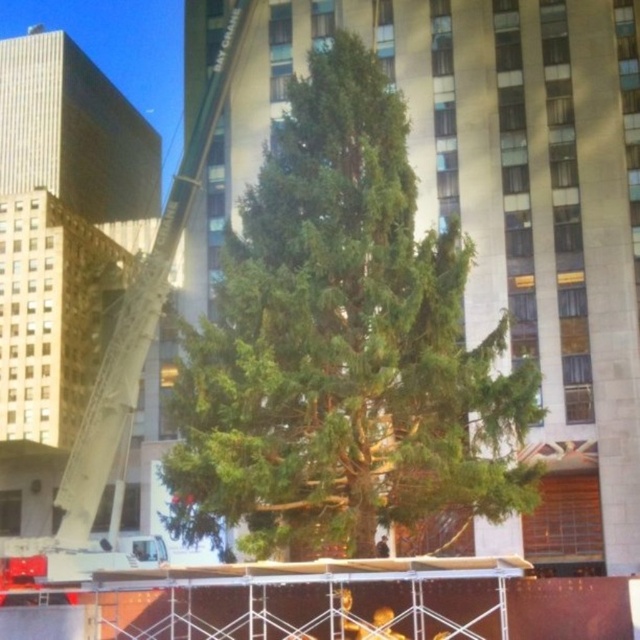
Question: Is green needle-like at center wider than white metal crane at center?

Choices:
 (A) no
 (B) yes

Answer: (B)

Question: Does green needle-like at center have a smaller size compared to white metal crane at center?

Choices:
 (A) yes
 (B) no

Answer: (A)

Question: Among these points, which one is farthest from the camera?

Choices:
 (A) (19, 548)
 (B) (333, 81)
 (C) (385, 547)

Answer: (A)

Question: Can you confirm if white metal crane at center is positioned to the right of dark blue uniform at center?

Choices:
 (A) yes
 (B) no

Answer: (B)

Question: Which of the following is the closest to the observer?

Choices:
 (A) green needle-like at center
 (B) dark blue uniform at center

Answer: (A)

Question: Which object is the farthest from the dark blue uniform at center?

Choices:
 (A) white metal crane at center
 (B) green needle-like at center

Answer: (A)